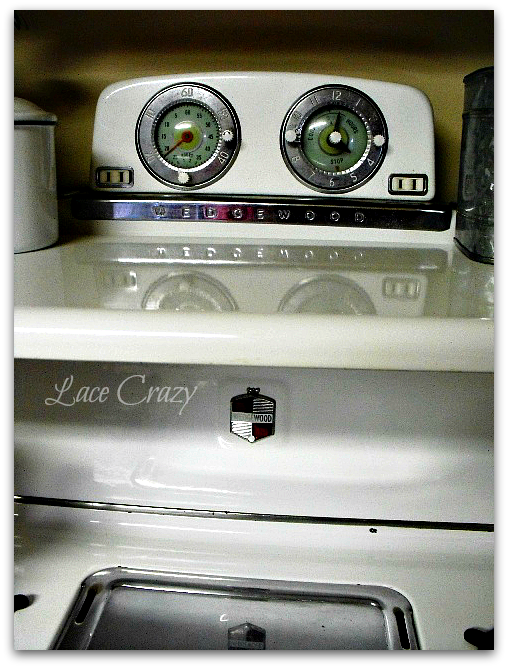
At what (x,y) coordinates should I click in order to perform the action: click on white switch. Please return your answer as a coordinate pair (x, y). Looking at the image, I should click on 410,182, 116,174.